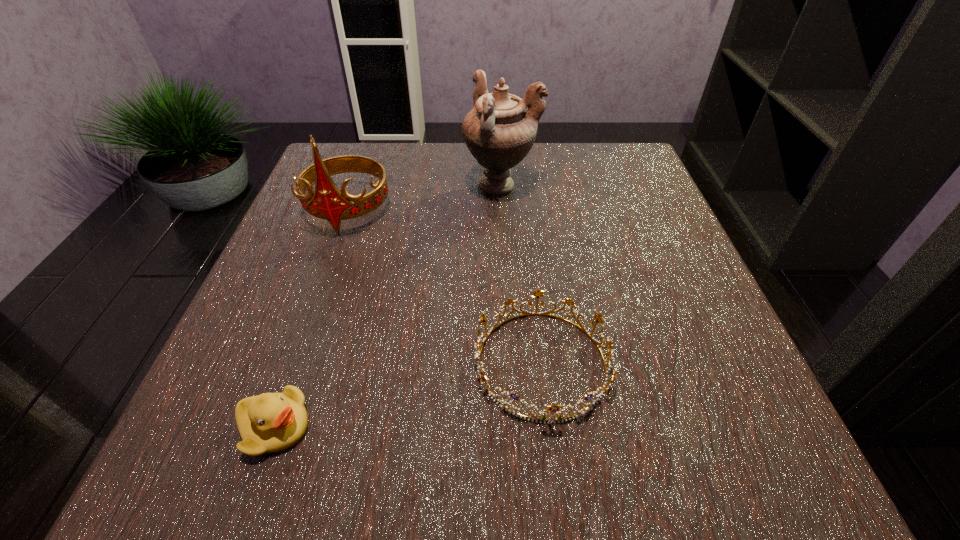
In the image, there is a desktop. What are the coordinates of `vacant space at the right edge` in the screenshot? It's located at (628, 314).

This screenshot has height=540, width=960. In order to click on vacant space at the far left corner of the desktop in this screenshot , I will do `click(360, 186)`.

In the image, there is a desktop. Identify the location of free space at the far right corner. (615, 170).

You are a GUI agent. You are given a task and a screenshot of the screen. Output one action in this format:
    pyautogui.click(x=<x>, y=<y>)
    Task: Click on the free space between the nearer tiara and the duckling
    
    Given the screenshot: What is the action you would take?
    pyautogui.click(x=408, y=395)

This screenshot has width=960, height=540. Identify the location of vacant area that lies between the shorter tiara and the duckling. (408, 395).

Find the location of a particular element. The height and width of the screenshot is (540, 960). free space between the left tiara and the urn is located at coordinates (424, 199).

Locate an element on the screen. The height and width of the screenshot is (540, 960). blank region between the shorter tiara and the urn is located at coordinates (521, 275).

I want to click on unoccupied area between the urn and the nearer tiara, so click(521, 275).

Identify the location of free space between the urn and the farther tiara. (424, 199).

Locate an element on the screen. The width and height of the screenshot is (960, 540). vacant area that lies between the duckling and the left tiara is located at coordinates (311, 319).